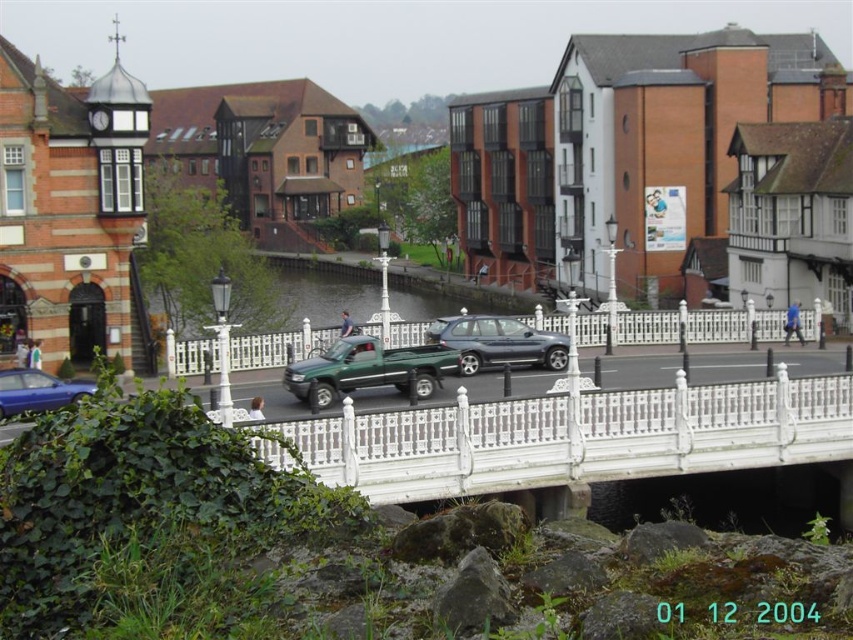
You are a pedestrian standing on the white ornate railing in the foreground. You see a green matte truck at center and a metallic blue sedan at lower left. Which vehicle is positioned higher relative to the other?

The green matte truck at center is above the metallic blue sedan at lower left, so it is positioned higher.

You are standing on the white ornate railing and want to take a photo of the green matte truck at center. Where should you aim your camera to capture it?

You should aim your camera at point (368, 369) to capture the green matte truck at center.

You are a delivery drone that needs to pass under the white wrought iron bridge at center and the white wrought iron fence at center. Which one do you need to fly lower to avoid collision?

The white wrought iron bridge at center has a greater height compared to the white wrought iron fence at center, so you need to fly lower to avoid collision with the white wrought iron fence at center.